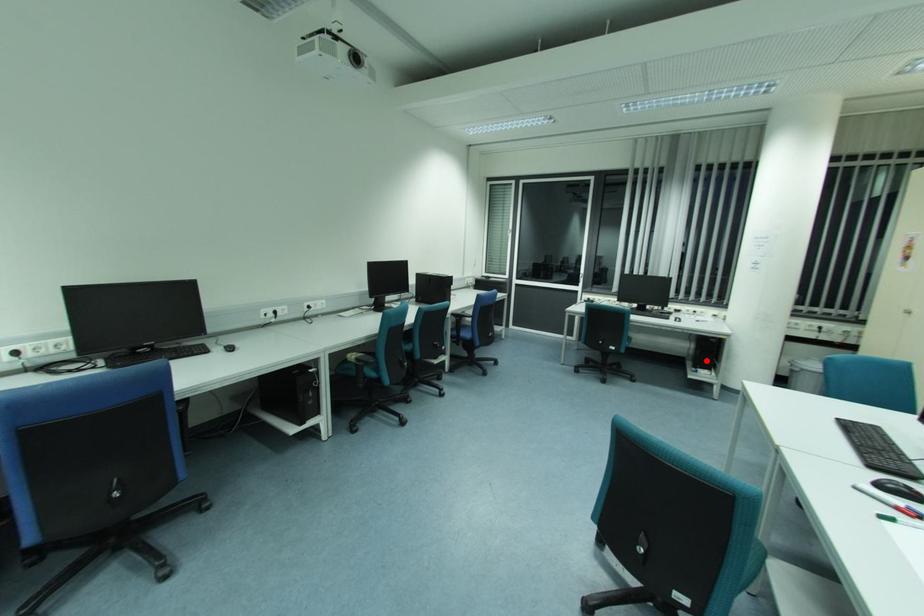
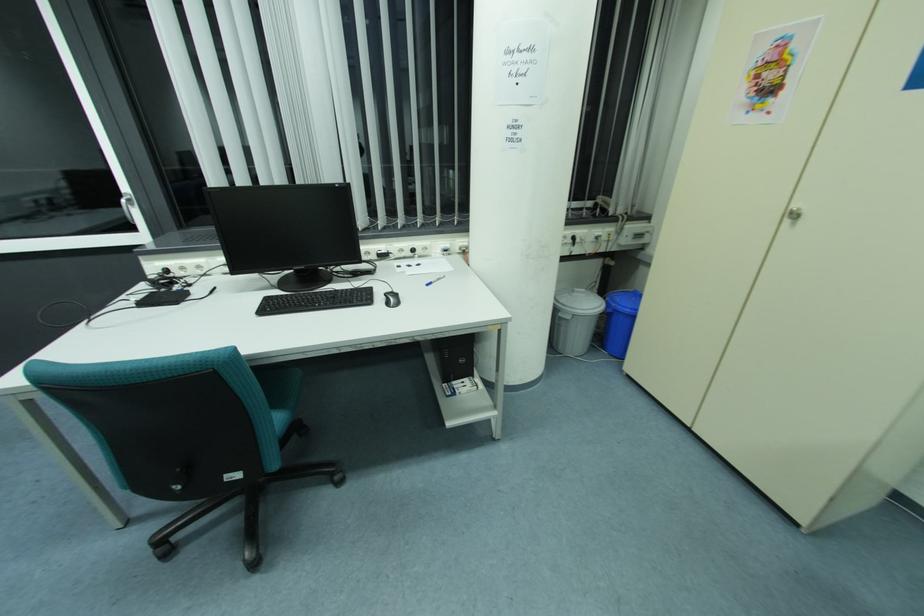
The point at the highlighted location is marked in the first image. Where is the corresponding point in the second image?

(462, 361)